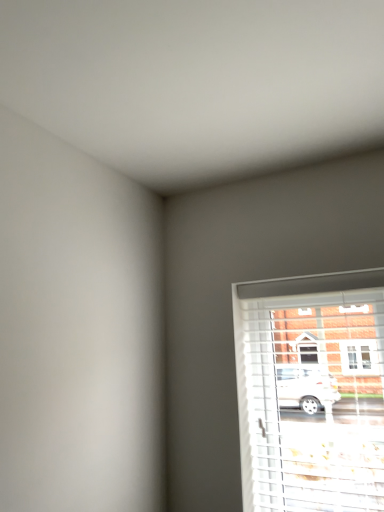
Image resolution: width=384 pixels, height=512 pixels. What are the coordinates of `white plastic blinds at lower right` in the screenshot? It's located at (311, 392).

Describe the element at coordinates (311, 392) in the screenshot. I see `white plastic blinds at lower right` at that location.

This screenshot has width=384, height=512. Find the location of `white plastic blinds at lower right`. white plastic blinds at lower right is located at coordinates coord(311,392).